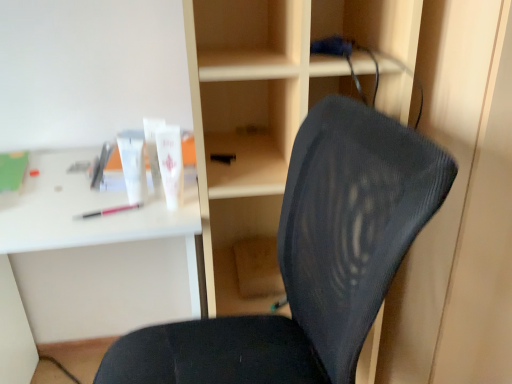
Question: Is white matte tube at upper center, the first toiletry from the right, outside wooden at center?

Choices:
 (A) no
 (B) yes

Answer: (B)

Question: From a real-world perspective, is white matte tube at upper center, the first toiletry from the right, on top of wooden at center?

Choices:
 (A) no
 (B) yes

Answer: (B)

Question: Would you say wooden at center is part of white matte tube at upper center, the 3th toiletry in the left-to-right sequence,'s contents?

Choices:
 (A) yes
 (B) no

Answer: (B)

Question: Is white matte tube at upper center, the first toiletry from the right, shorter than wooden at center?

Choices:
 (A) yes
 (B) no

Answer: (A)

Question: From the image's perspective, is white matte tube at upper center, the 3th toiletry in the left-to-right sequence, on top of wooden at center?

Choices:
 (A) yes
 (B) no

Answer: (A)

Question: Is pink plastic pen at left in front of or behind black mesh chair at center in the image?

Choices:
 (A) behind
 (B) front

Answer: (A)

Question: In terms of height, does pink plastic pen at left look taller or shorter compared to black mesh chair at center?

Choices:
 (A) tall
 (B) short

Answer: (B)

Question: Considering the positions of pink plastic pen at left and black mesh chair at center in the image, is pink plastic pen at left wider or thinner than black mesh chair at center?

Choices:
 (A) wide
 (B) thin

Answer: (B)

Question: Considering the positions of pink plastic pen at left and black mesh chair at center in the image, is pink plastic pen at left bigger or smaller than black mesh chair at center?

Choices:
 (A) small
 (B) big

Answer: (A)

Question: From their relative heights in the image, would you say white matte tube at upper center, the 3th toiletry in the left-to-right sequence, is taller or shorter than white plastic desk at upper left?

Choices:
 (A) short
 (B) tall

Answer: (A)

Question: Choose the correct answer: Is white matte tube at upper center, the first toiletry from the right, inside white plastic desk at upper left or outside it?

Choices:
 (A) inside
 (B) outside

Answer: (B)

Question: Visually, is white matte tube at upper center, the first toiletry from the right, positioned to the left or to the right of white plastic desk at upper left?

Choices:
 (A) left
 (B) right

Answer: (B)

Question: Considering their positions, is white matte tube at upper center, the 3th toiletry in the left-to-right sequence, located in front of or behind white plastic desk at upper left?

Choices:
 (A) behind
 (B) front

Answer: (A)

Question: Looking at their shapes, would you say black mesh chair at center is wider or thinner than white matte tube at upper center, the 3th toiletry in the left-to-right sequence?

Choices:
 (A) wide
 (B) thin

Answer: (A)

Question: Is black mesh chair at center bigger or smaller than white matte tube at upper center, the first toiletry from the right?

Choices:
 (A) big
 (B) small

Answer: (A)